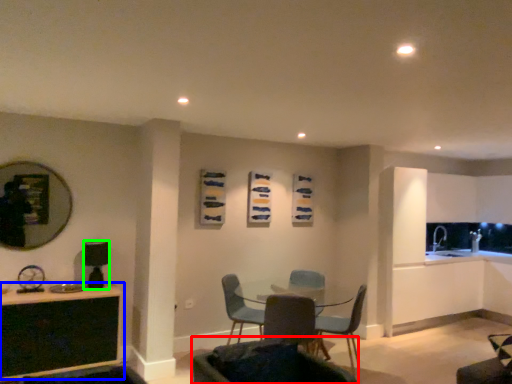
Question: Considering the real-world distances, which object is farthest from chair (highlighted by a red box)? table (highlighted by a blue box) or appliance (highlighted by a green box)?

Choices:
 (A) table
 (B) appliance

Answer: (B)